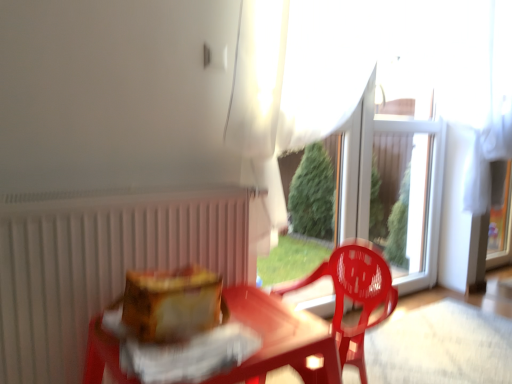
Question: Can you confirm if white sheer curtain at upper center is thinner than white matte radiator at left?

Choices:
 (A) yes
 (B) no

Answer: (B)

Question: Is white matte radiator at left completely or partially inside white sheer curtain at upper center?

Choices:
 (A) no
 (B) yes

Answer: (A)

Question: From the image's perspective, is white sheer curtain at upper center on top of white matte radiator at left?

Choices:
 (A) no
 (B) yes

Answer: (B)

Question: From the image's perspective, is white sheer curtain at upper center beneath white matte radiator at left?

Choices:
 (A) yes
 (B) no

Answer: (B)

Question: Is white sheer curtain at upper center turned away from white matte radiator at left?

Choices:
 (A) yes
 (B) no

Answer: (B)

Question: Does white sheer curtain at upper center have a smaller size compared to white matte radiator at left?

Choices:
 (A) no
 (B) yes

Answer: (A)

Question: Is translucent plastic chair at center behind transparent plastic glass door at center?

Choices:
 (A) no
 (B) yes

Answer: (A)

Question: From the image's perspective, is translucent plastic chair at center over transparent plastic glass door at center?

Choices:
 (A) yes
 (B) no

Answer: (B)

Question: Is transparent plastic glass door at center surrounded by translucent plastic chair at center?

Choices:
 (A) no
 (B) yes

Answer: (A)

Question: Is translucent plastic chair at center bigger than transparent plastic glass door at center?

Choices:
 (A) no
 (B) yes

Answer: (A)

Question: Considering the relative positions of translucent plastic chair at center and transparent plastic glass door at center in the image provided, is translucent plastic chair at center in front of transparent plastic glass door at center?

Choices:
 (A) no
 (B) yes

Answer: (B)

Question: Is translucent plastic chair at center far away from transparent plastic glass door at center?

Choices:
 (A) yes
 (B) no

Answer: (B)

Question: Does white matte radiator at left appear on the right side of translucent plastic chair at center?

Choices:
 (A) no
 (B) yes

Answer: (A)